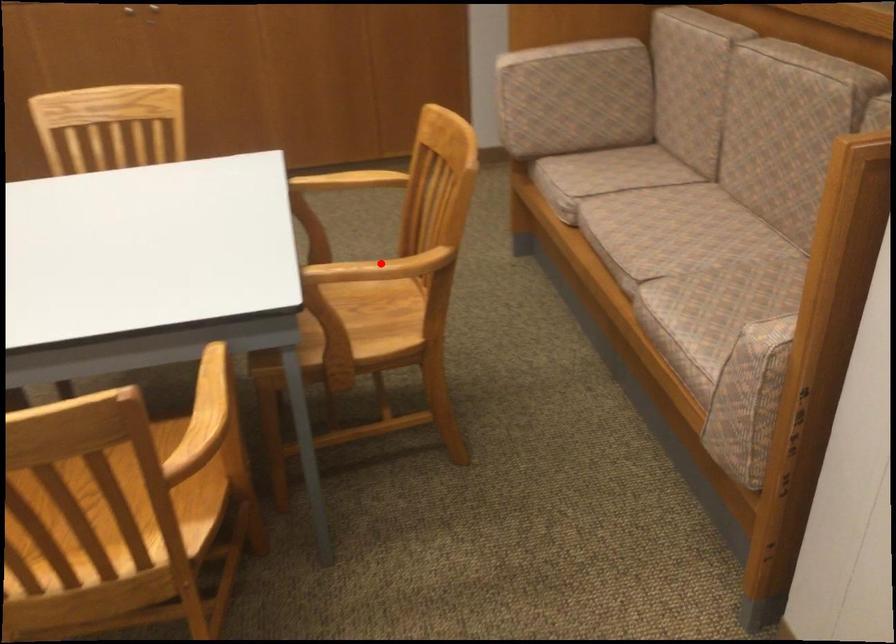
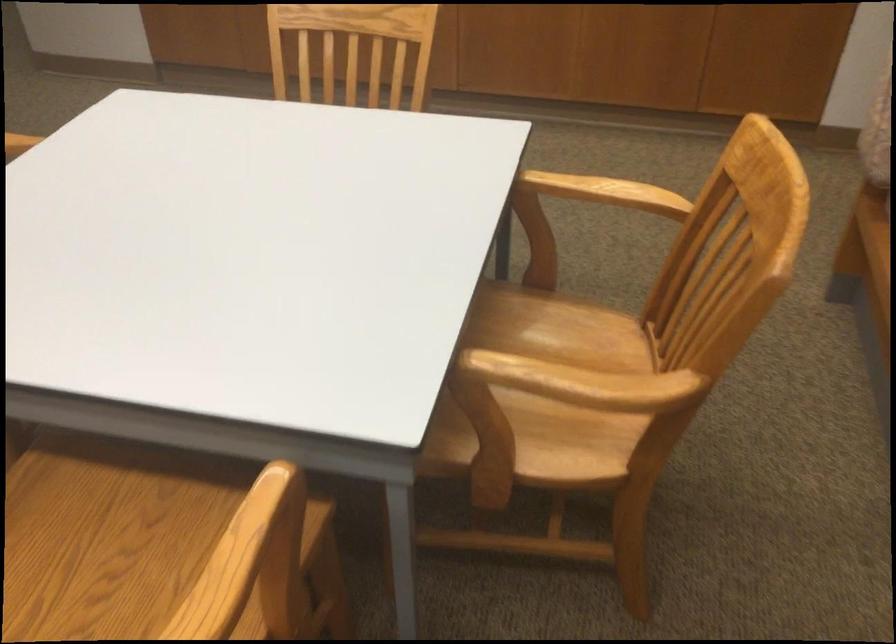
In the second image, find the point that corresponds to the highlighted location in the first image.

(583, 383)